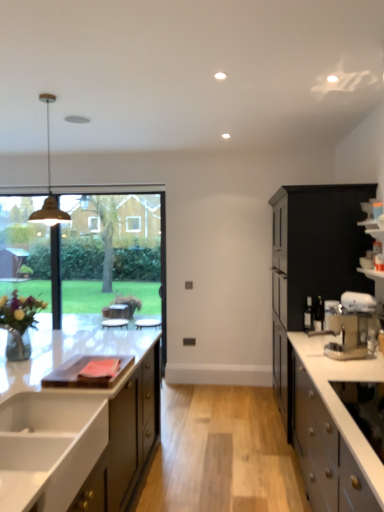
The image size is (384, 512). I want to click on free space above matte brass pendant light at upper left (from a real-world perspective), so click(47, 96).